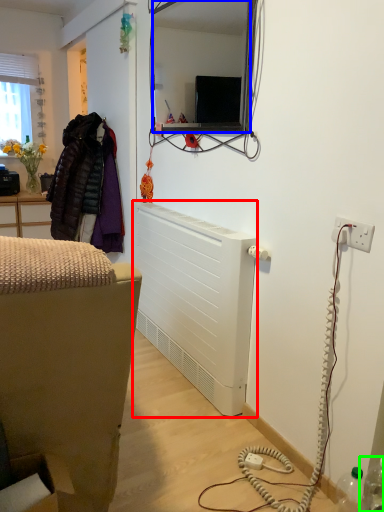
Question: Which is farther away from radiator (highlighted by a red box)? mirror (highlighted by a blue box) or bottle (highlighted by a green box)?

Choices:
 (A) mirror
 (B) bottle

Answer: (A)